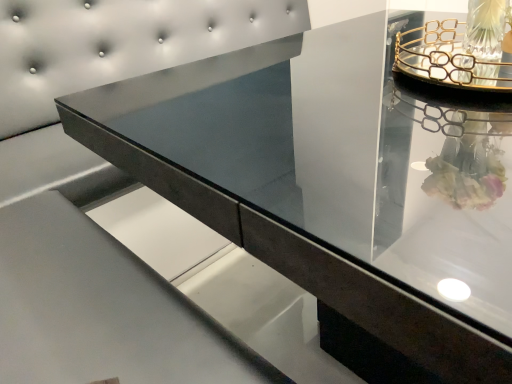
The width and height of the screenshot is (512, 384). What do you see at coordinates (485, 37) in the screenshot? I see `clear glass vase at upper right` at bounding box center [485, 37].

Where is `clear glass vase at upper right`? The height and width of the screenshot is (384, 512). clear glass vase at upper right is located at coordinates (485, 37).

Looking at this image, measure the distance between clear glass vase at upper right and camera.

A distance of 29.92 inches exists between clear glass vase at upper right and camera.

This screenshot has width=512, height=384. In order to click on clear glass vase at upper right in this screenshot , I will do `click(485, 37)`.